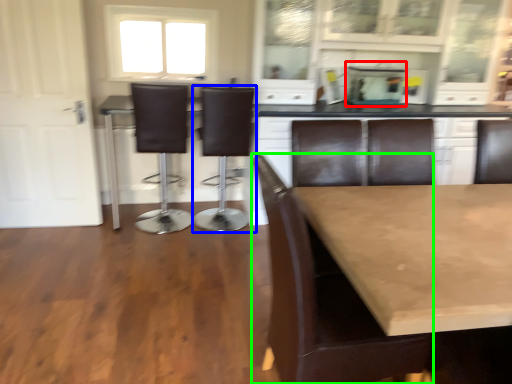
Question: Which object is the farthest from appliance (highlighted by a red box)? Choose among these: chair (highlighted by a blue box) or chair (highlighted by a green box).

Choices:
 (A) chair
 (B) chair

Answer: (B)